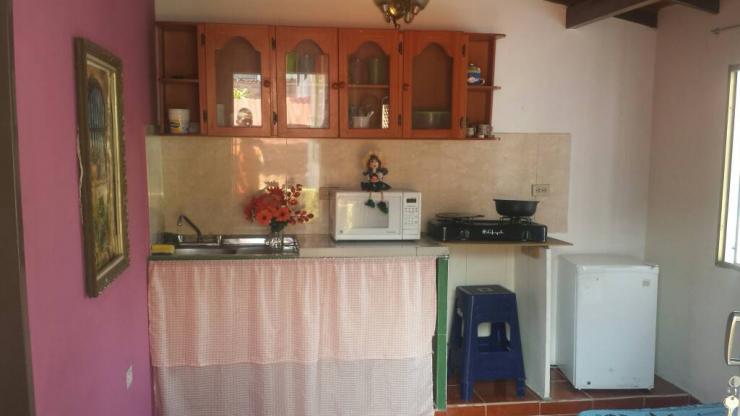
Find the location of `fridge`. fridge is located at coordinates 610,339.